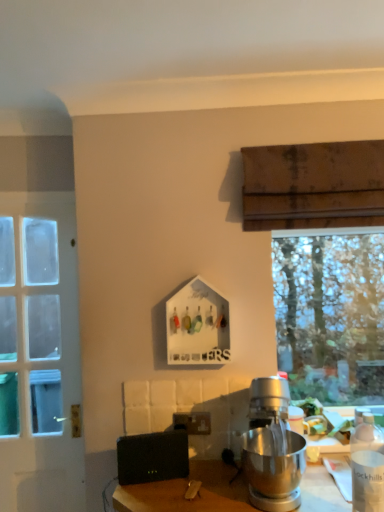
Question: Is black matte speaker at lower center facing towards white glass door at left?

Choices:
 (A) no
 (B) yes

Answer: (A)

Question: Considering the relative positions of black matte speaker at lower center and white glass door at left in the image provided, is black matte speaker at lower center behind white glass door at left?

Choices:
 (A) yes
 (B) no

Answer: (B)

Question: Is black matte speaker at lower center bigger than white glass door at left?

Choices:
 (A) yes
 (B) no

Answer: (B)

Question: From a real-world perspective, is black matte speaker at lower center on white glass door at left?

Choices:
 (A) yes
 (B) no

Answer: (B)

Question: Considering the relative sizes of black matte speaker at lower center and white glass door at left in the image provided, is black matte speaker at lower center shorter than white glass door at left?

Choices:
 (A) no
 (B) yes

Answer: (B)

Question: Is black matte speaker at lower center in contact with white glass door at left?

Choices:
 (A) yes
 (B) no

Answer: (B)

Question: Does white glass door at left appear on the right side of black matte speaker at lower center?

Choices:
 (A) yes
 (B) no

Answer: (B)

Question: Is white glass door at left shorter than black matte speaker at lower center?

Choices:
 (A) yes
 (B) no

Answer: (B)

Question: Can you confirm if white glass door at left is wider than black matte speaker at lower center?

Choices:
 (A) no
 (B) yes

Answer: (B)

Question: Does white glass door at left have a larger size compared to black matte speaker at lower center?

Choices:
 (A) yes
 (B) no

Answer: (A)

Question: Does white glass door at left appear on the left side of black matte speaker at lower center?

Choices:
 (A) yes
 (B) no

Answer: (A)

Question: Is white glass door at left not inside black matte speaker at lower center?

Choices:
 (A) yes
 (B) no

Answer: (A)

Question: Could white matte bottle at lower right be considered to be inside silver metallic stand mixer at center?

Choices:
 (A) yes
 (B) no

Answer: (B)